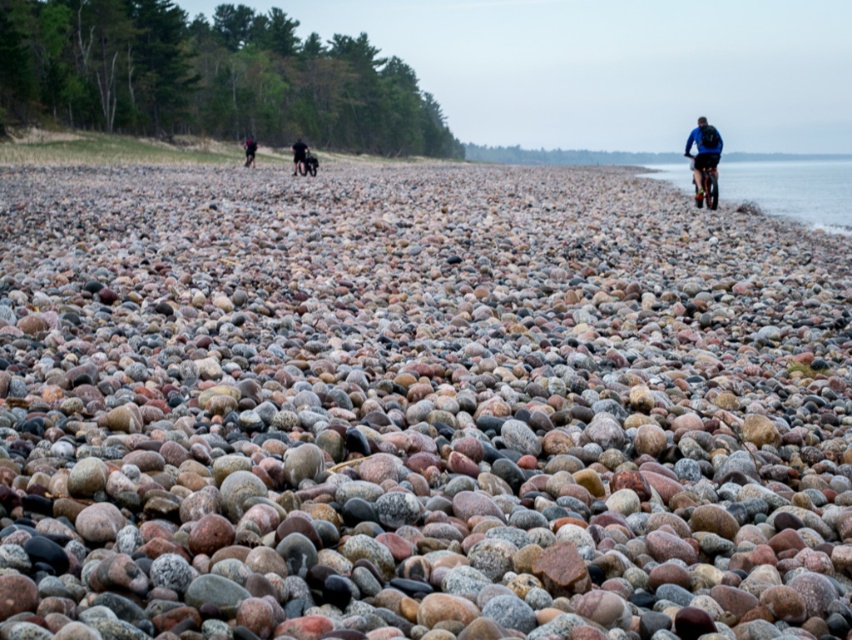
You are standing at the center of the beach and want to place a small flag exactly where the blue fabric jacket at right is located. What are the coordinates of the spot where you should place the flag?

The coordinates for the blue fabric jacket at right are at point [703,154], so you should place the flag at those coordinates.

You are standing on the pebble beach and want to walk towards the two people in the scene. The first person is at point (700,131) and the second person is at point (248,147). Which point should you head towards if you want to reach the person who is closer to you first?

You should head towards point (700,131) because it is closer to you than point (248,147).

You are standing on the pebble beach and see the speckled rock at center and the black fabric pants at center. Which object is closer to you?

The speckled rock at center is closer to you because it is in front of the black fabric pants at center.